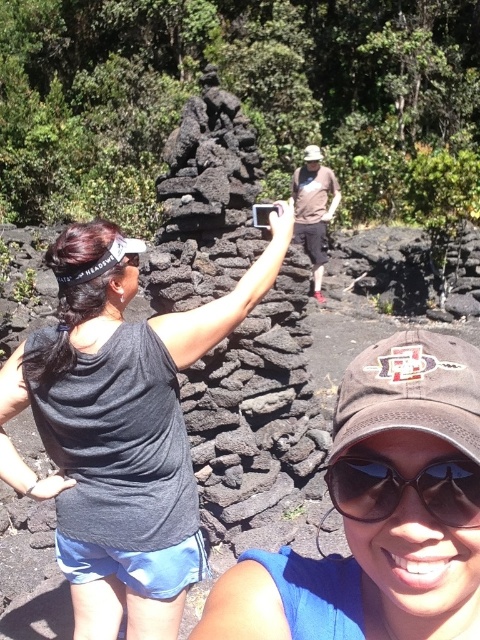
Is brown fabric cap at center taller than black reflective sunglasses at lower center?

Indeed, brown fabric cap at center has a greater height compared to black reflective sunglasses at lower center.

Is brown fabric cap at center behind black reflective sunglasses at lower center?

That is False.

Where is `brown fabric cap at center`? This screenshot has height=640, width=480. brown fabric cap at center is located at coordinates (381, 512).

Can you confirm if matte black tank top at center is positioned to the left of brown fabric baseball hat at center?

Indeed, matte black tank top at center is positioned on the left side of brown fabric baseball hat at center.

Which of these two, matte black tank top at center or brown fabric baseball hat at center, stands shorter?

With less height is matte black tank top at center.

Locate an element on the screen. matte black tank top at center is located at coordinates (61, 364).

Does brown fabric baseball cap at center appear on the right side of black reflective sunglasses at lower center?

Yes, brown fabric baseball cap at center is to the right of black reflective sunglasses at lower center.

Who is shorter, brown fabric baseball cap at center or black reflective sunglasses at lower center?

With less height is black reflective sunglasses at lower center.

Where is `brown fabric baseball cap at center`? This screenshot has height=640, width=480. brown fabric baseball cap at center is located at coordinates point(410,392).

The height and width of the screenshot is (640, 480). Identify the location of brown fabric baseball cap at center. (410, 392).